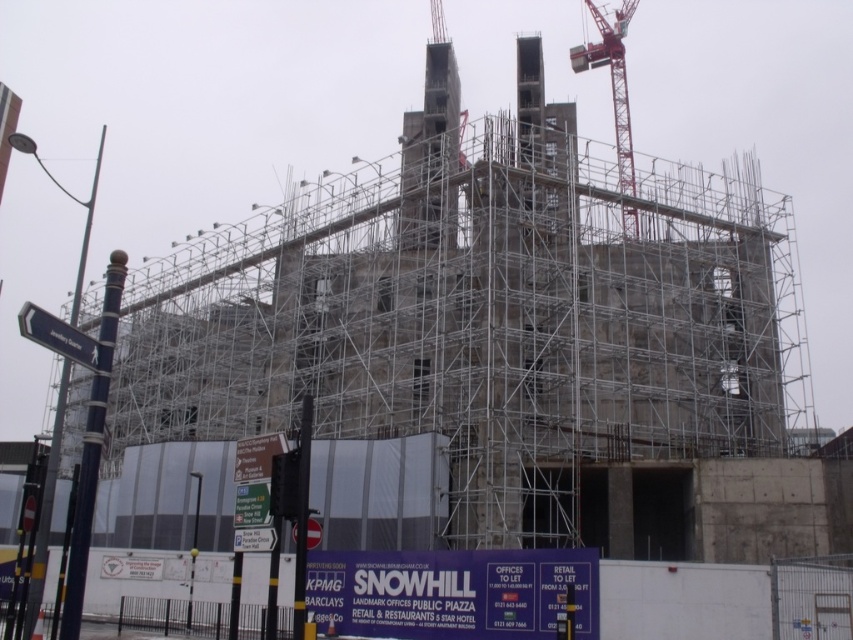
Is red metal crane at upper right to the right of white plastic street sign at left from the viewer's perspective?

Yes, red metal crane at upper right is to the right of white plastic street sign at left.

Measure the distance between red metal crane at upper right and camera.

A distance of 73.75 meters exists between red metal crane at upper right and camera.

Does point (614, 61) lie in front of point (45, 323)?

No.

Find the location of a particular element. This screenshot has height=640, width=853. red metal crane at upper right is located at coordinates (612, 80).